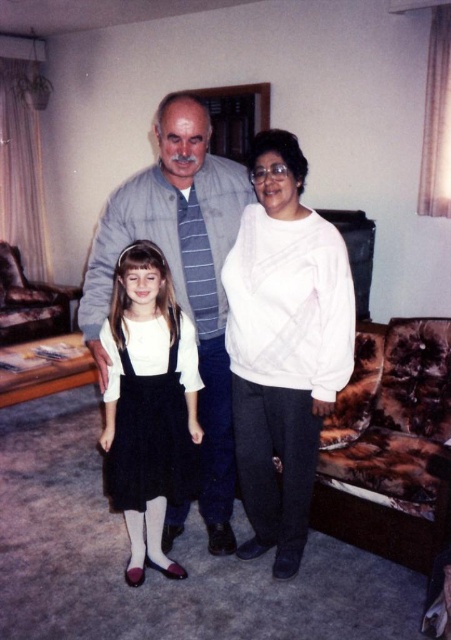
Who is positioned more to the left, white soft sweater at center or brown fur couch at left?

Positioned to the left is brown fur couch at left.

Consider the image. Between white soft sweater at center and brown fur couch at left, which one is positioned higher?

brown fur couch at left

Identify the location of white soft sweater at center. tap(284, 346).

Where is `white soft sweater at center`? This screenshot has width=451, height=640. white soft sweater at center is located at coordinates (284, 346).

Between fur-like fabric couch at lower right and white matte dress at center, which one appears on the left side from the viewer's perspective?

From the viewer's perspective, white matte dress at center appears more on the left side.

Does fur-like fabric couch at lower right appear on the left side of white matte dress at center?

No, fur-like fabric couch at lower right is not to the left of white matte dress at center.

Where is `fur-like fabric couch at lower right`? This screenshot has height=640, width=451. fur-like fabric couch at lower right is located at coordinates (395, 445).

Identify the location of fur-like fabric couch at lower right. This screenshot has width=451, height=640. (395, 445).

Between point (174, 288) and point (192, 333), which one is positioned in front?

Point (192, 333) is in front.

Is gray striped shirt at center thinner than white matte dress at center?

Incorrect, gray striped shirt at center's width is not less than white matte dress at center's.

Image resolution: width=451 pixels, height=640 pixels. I want to click on gray striped shirt at center, so click(182, 275).